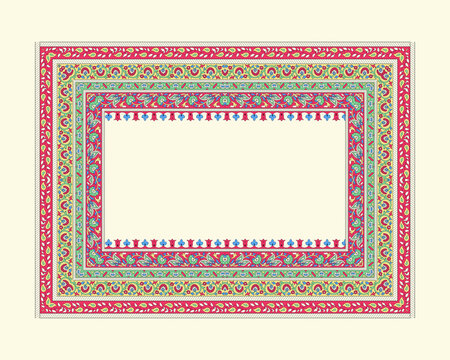
Find the location of a particular element. The width and height of the screenshot is (450, 360). bottom right corner of rug is located at coordinates (414, 313).